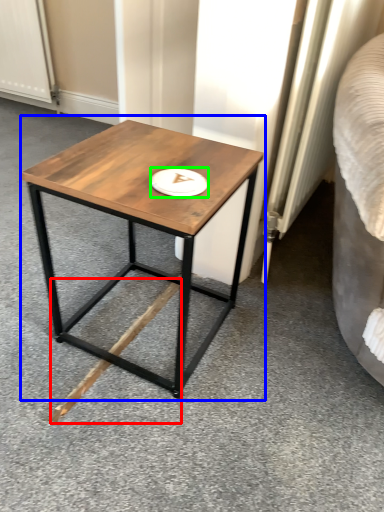
Question: Which object is the farthest from wood (highlighted by a red box)? Choose among these: coffee table (highlighted by a blue box) or platter (highlighted by a green box).

Choices:
 (A) coffee table
 (B) platter

Answer: (B)